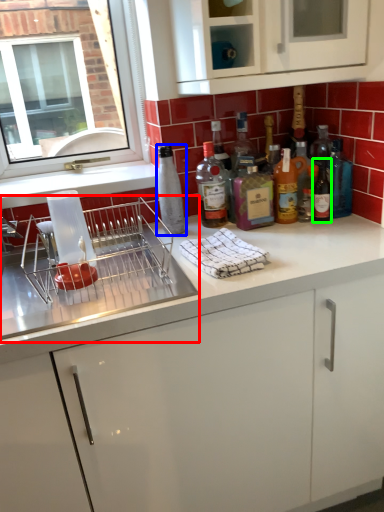
Question: Which object is the closest to the appliance (highlighted by a red box)? Choose among these: bottle (highlighted by a blue box) or wine bottle (highlighted by a green box).

Choices:
 (A) bottle
 (B) wine bottle

Answer: (A)